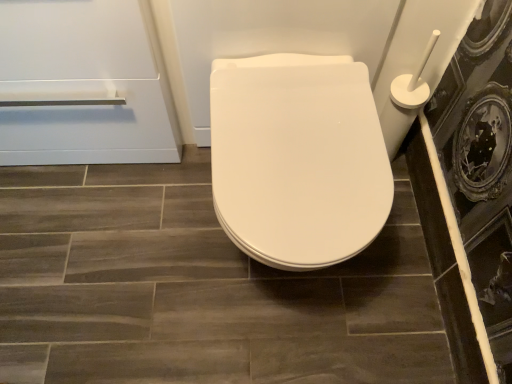
Locate an element on the screen. This screenshot has height=384, width=512. free location to the left of transparent glass screen door at right is located at coordinates (311, 278).